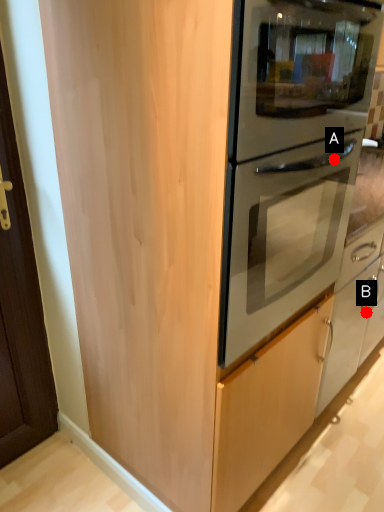
Question: Two points are circled on the image, labeled by A and B beside each circle. Among these points, which one is farthest from the camera?

Choices:
 (A) A is further
 (B) B is further

Answer: (B)